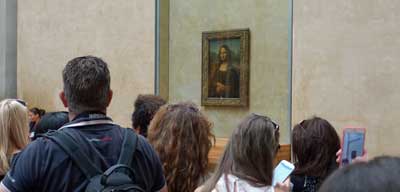
Find the location of a particular element. This screenshot has height=192, width=400. two sides to beige wall is located at coordinates 116,45, 336,38.